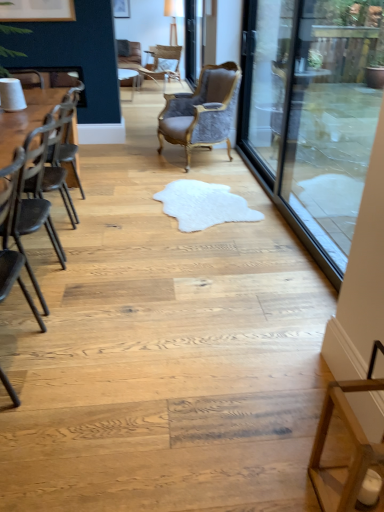
This screenshot has width=384, height=512. What do you see at coordinates (29, 117) in the screenshot?
I see `wooden table at left` at bounding box center [29, 117].

In order to face clear glass screen door at upper center, which appears as the 2th screen door when viewed from the right, should I rotate leftwards or rightwards?

It's best to rotate right around 0.325 degrees.

Image resolution: width=384 pixels, height=512 pixels. Find the location of `white fluffy rug at center`. white fluffy rug at center is located at coordinates (203, 205).

What do you see at coordinates (312, 112) in the screenshot?
I see `transparent glass door at right` at bounding box center [312, 112].

The width and height of the screenshot is (384, 512). Find the location of `light brown woven chair at upper center, which is counted as the first chair, starting from the back`. light brown woven chair at upper center, which is counted as the first chair, starting from the back is located at coordinates (162, 63).

Describe the element at coordinates (9, 234) in the screenshot. I see `black metal chair at left, the first chair viewed from the front` at that location.

Find the location of `dark brown wood chair at left, which ranks as the 2th chair in front-to-back order`. dark brown wood chair at left, which ranks as the 2th chair in front-to-back order is located at coordinates (35, 203).

Can you confirm if transparent glass door at right is taller than black metal chair at left, the first chair viewed from the front?

Indeed, transparent glass door at right has a greater height compared to black metal chair at left, the first chair viewed from the front.

From a real-world perspective, who is located lower, transparent glass door at right or black metal chair at left, which ranks as the first chair in bottom-to-top order?

In real-world perspective, black metal chair at left, which ranks as the first chair in bottom-to-top order, is lower.

The height and width of the screenshot is (512, 384). I want to click on glass door lying behind the black metal chair at left, the 4th chair viewed from the back, so click(312, 112).

Is transparent glass screen door at right, the first screen door from the right, completely or partially inside black metal chair at left, the 4th chair viewed from the back?

No, transparent glass screen door at right, the first screen door from the right, is located outside of black metal chair at left, the 4th chair viewed from the back.

Is black metal chair at left, which ranks as the first chair in bottom-to-top order, positioned with its back to transparent glass screen door at right, arranged as the second screen door when viewed from the top?

No, black metal chair at left, which ranks as the first chair in bottom-to-top order, is not facing the opposite direction of transparent glass screen door at right, arranged as the second screen door when viewed from the top.

Is black metal chair at left, which ranks as the first chair in bottom-to-top order, far away from transparent glass screen door at right, which appears as the 1th screen door when ordered from the bottom?

Yes.

Is clear glass screen door at upper center, arranged as the 1th screen door when viewed from the left, oriented away from dark brown wood chair at left, the third chair viewed from the top?

clear glass screen door at upper center, arranged as the 1th screen door when viewed from the left, is not turned away from dark brown wood chair at left, the third chair viewed from the top.

Looking at their sizes, would you say clear glass screen door at upper center, which appears as the 2th screen door when viewed from the right, is wider or thinner than dark brown wood chair at left, arranged as the 3th chair when viewed from the back?

In the image, clear glass screen door at upper center, which appears as the 2th screen door when viewed from the right, appears to be more narrow than dark brown wood chair at left, arranged as the 3th chair when viewed from the back.

Between clear glass screen door at upper center, which is the 1th screen door in top-to-bottom order, and dark brown wood chair at left, arranged as the 3th chair when viewed from the back, which one has less height?

dark brown wood chair at left, arranged as the 3th chair when viewed from the back.

Between wooden table at left and black metal chair at left, which ranks as the first chair in bottom-to-top order, which one has smaller width?

Thinner between the two is black metal chair at left, which ranks as the first chair in bottom-to-top order.

Identify the location of table behind the black metal chair at left, the fourth chair when ordered from top to bottom. The height and width of the screenshot is (512, 384). (29, 117).

From the picture: Is wooden table at left turned away from black metal chair at left, the 4th chair viewed from the back?

No, wooden table at left is not facing away from black metal chair at left, the 4th chair viewed from the back.

Considering the sizes of wooden table at left and black metal chair at left, the fourth chair when ordered from top to bottom, in the image, is wooden table at left taller or shorter than black metal chair at left, the fourth chair when ordered from top to bottom,?

wooden table at left is shorter than black metal chair at left, the fourth chair when ordered from top to bottom.

Which object is thinner, transparent glass screen door at right, the 1th screen door from the front, or black metal chair at left, the first chair viewed from the front?

transparent glass screen door at right, the 1th screen door from the front.

Is point (290, 36) farther from camera compared to point (5, 244)?

Yes, point (290, 36) is farther from viewer.

Is the depth of transparent glass screen door at right, arranged as the second screen door when viewed from the top, greater than that of black metal chair at left, the 4th chair viewed from the back?

That is True.

Does transparent glass screen door at right, arranged as the second screen door when viewed from the top, have a smaller size compared to black metal chair at left, which ranks as the first chair in bottom-to-top order?

No, transparent glass screen door at right, arranged as the second screen door when viewed from the top, is not smaller than black metal chair at left, which ranks as the first chair in bottom-to-top order.

Can you confirm if velvet grey chair at center, the third chair when ordered from front to back, is thinner than wooden table at left?

No.

Does velvet grey chair at center, the third chair when ordered from front to back, have a smaller size compared to wooden table at left?

No.

Considering the relative positions of velvet grey chair at center, marked as the 2th chair in a top-to-bottom arrangement, and wooden table at left in the image provided, is velvet grey chair at center, marked as the 2th chair in a top-to-bottom arrangement, to the left or to the right of wooden table at left?

Clearly, velvet grey chair at center, marked as the 2th chair in a top-to-bottom arrangement, is on the right of wooden table at left in the image.

Between velvet grey chair at center, the third chair when ordered from front to back, and wooden table at left, which one is positioned behind?

velvet grey chair at center, the third chair when ordered from front to back, is further away from the camera.

Is matte white picture frame at upper left at the back of wooden table at left?

That's not correct — wooden table at left is not looking away from matte white picture frame at upper left.

At what (x,y) coordinates should I click in order to perform the action: click on table that appears below the matte white picture frame at upper left (from the image's perspective). Please return your answer as a coordinate pair (x, y). This screenshot has height=512, width=384. Looking at the image, I should click on (29, 117).

Considering the sizes of objects wooden table at left and matte white picture frame at upper left in the image provided, who is wider, wooden table at left or matte white picture frame at upper left?

wooden table at left.

Is wooden table at left closer to the viewer compared to matte white picture frame at upper left?

Yes, the depth of wooden table at left is less than that of matte white picture frame at upper left.

The width and height of the screenshot is (384, 512). Find the location of `glass door on the right of the black metal chair at left, the 4th chair viewed from the back`. glass door on the right of the black metal chair at left, the 4th chair viewed from the back is located at coordinates (312, 112).

Find the location of a particular element. This screenshot has width=384, height=512. chair that is the 2nd object located in front of the transparent glass screen door at right, arranged as the second screen door when viewed from the top is located at coordinates (9, 234).

Estimate the real-world distances between objects in this image. Which object is closer to white fluffy rug at center, matte white picture frame at upper left or clear glass screen door at upper center, which is the 1th screen door in top-to-bottom order?

The object closer to white fluffy rug at center is clear glass screen door at upper center, which is the 1th screen door in top-to-bottom order.

Considering their positions, is dark brown wood chair at left, positioned as the 2th chair in bottom-to-top order, positioned further to transparent glass door at right than velvet grey chair at center, the third chair when ordered from front to back?

Based on the image, dark brown wood chair at left, positioned as the 2th chair in bottom-to-top order, appears to be further to transparent glass door at right.

Considering their positions, is matte white picture frame at upper left positioned closer to velvet grey chair at center, acting as the third chair starting from the bottom, than dark brown wood chair at left, positioned as the 2th chair in bottom-to-top order?

dark brown wood chair at left, positioned as the 2th chair in bottom-to-top order.

Looking at the image, which one is located further to transparent glass door at right, clear glass screen door at upper center, which appears as the first screen door when viewed from the back, or dark brown wood chair at left, which ranks as the 2th chair in front-to-back order?

clear glass screen door at upper center, which appears as the first screen door when viewed from the back, is positioned further to the anchor transparent glass door at right.

From the image, which object appears to be farther from white fluffy rug at center, clear glass screen door at upper center, which is the 1th screen door in top-to-bottom order, or transparent glass door at right?

The object further to white fluffy rug at center is clear glass screen door at upper center, which is the 1th screen door in top-to-bottom order.

Considering their positions, is transparent glass screen door at right, which is the second screen door in back-to-front order, positioned further to matte white picture frame at upper left than black metal chair at left, which ranks as the first chair in bottom-to-top order?

black metal chair at left, which ranks as the first chair in bottom-to-top order.

Based on their spatial positions, is clear glass screen door at upper center, placed as the second screen door when sorted from bottom to top, or transparent glass screen door at right, the 1th screen door from the front, closer to matte white picture frame at upper left?

clear glass screen door at upper center, placed as the second screen door when sorted from bottom to top.

Estimate the real-world distances between objects in this image. Which object is closer to white fluffy rug at center, wooden table at left or velvet grey chair at center, the 2th chair positioned from the back?

The object closer to white fluffy rug at center is velvet grey chair at center, the 2th chair positioned from the back.

I want to click on screen door between velvet grey chair at center, acting as the third chair starting from the bottom, and matte white picture frame at upper left from front to back, so click(x=193, y=40).

The width and height of the screenshot is (384, 512). I want to click on chair between transparent glass screen door at right, which appears as the 1th screen door when ordered from the bottom, and light brown woven chair at upper center, which is counted as the first chair, starting from the back, from front to back, so click(202, 111).

What are the coordinates of `mat between black metal chair at left, the fourth chair when ordered from top to bottom, and velvet grey chair at center, the third chair when ordered from front to back, from front to back` in the screenshot? It's located at (203, 205).

The height and width of the screenshot is (512, 384). What are the coordinates of `mat situated between dark brown wood chair at left, which ranks as the 2th chair in front-to-back order, and transparent glass screen door at right, which is the second screen door in back-to-front order, from left to right` in the screenshot? It's located at (203, 205).